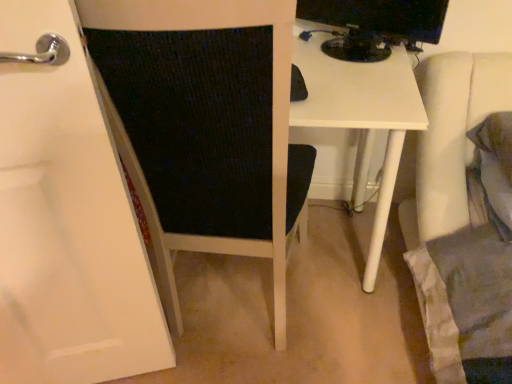
Question: Is black fabric chair at left not within black glossy monitor at upper right?

Choices:
 (A) yes
 (B) no

Answer: (A)

Question: Can you confirm if black fabric chair at left is positioned to the left of black glossy monitor at upper right?

Choices:
 (A) no
 (B) yes

Answer: (B)

Question: Is black fabric chair at left further to camera compared to black glossy monitor at upper right?

Choices:
 (A) yes
 (B) no

Answer: (B)

Question: Is black fabric chair at left positioned in front of black glossy monitor at upper right?

Choices:
 (A) no
 (B) yes

Answer: (B)

Question: Is black fabric chair at left next to black glossy monitor at upper right?

Choices:
 (A) yes
 (B) no

Answer: (B)

Question: Is black fabric chair at left looking in the opposite direction of black glossy monitor at upper right?

Choices:
 (A) yes
 (B) no

Answer: (B)

Question: Is the position of black glossy monitor at upper right more distant than that of black fabric chair at left?

Choices:
 (A) no
 (B) yes

Answer: (B)

Question: Does black glossy monitor at upper right have a lesser width compared to black fabric chair at left?

Choices:
 (A) no
 (B) yes

Answer: (B)

Question: Considering the relative sizes of black glossy monitor at upper right and black fabric chair at left in the image provided, is black glossy monitor at upper right wider than black fabric chair at left?

Choices:
 (A) no
 (B) yes

Answer: (A)

Question: From a real-world perspective, is black glossy monitor at upper right below black fabric chair at left?

Choices:
 (A) no
 (B) yes

Answer: (A)

Question: From the image's perspective, is black glossy monitor at upper right located above black fabric chair at left?

Choices:
 (A) no
 (B) yes

Answer: (B)

Question: Is black fabric chair at left completely or partially inside black glossy monitor at upper right?

Choices:
 (A) yes
 (B) no

Answer: (B)

Question: Is black fabric chair at left wider or thinner than black glossy monitor at upper right?

Choices:
 (A) thin
 (B) wide

Answer: (B)